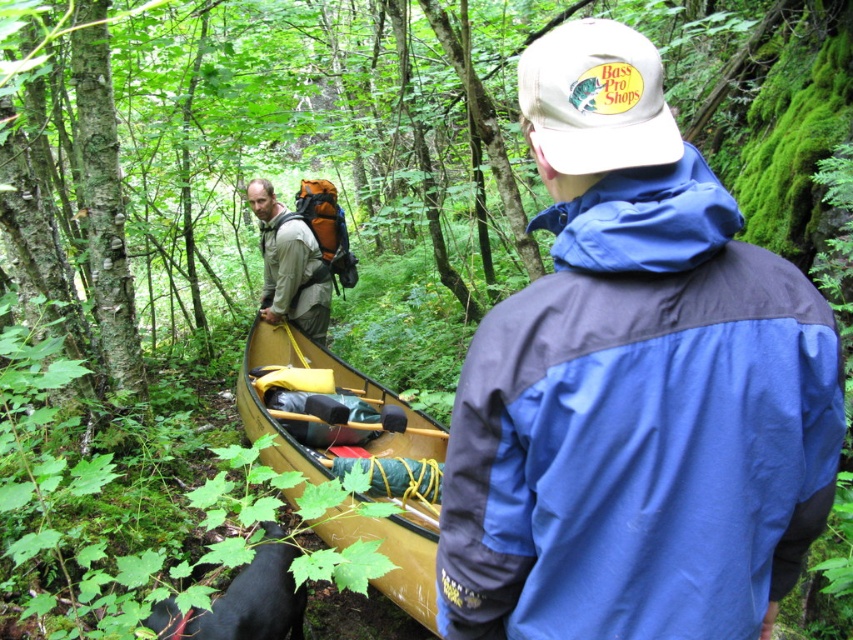
Question: Can you confirm if wooden canoe at center is thinner than yellow plastic paddle at center?

Choices:
 (A) no
 (B) yes

Answer: (A)

Question: Does wooden canoe at center come behind wooden paddle at center?

Choices:
 (A) no
 (B) yes

Answer: (A)

Question: Which object is positioned closest to the wooden canoe at center?

Choices:
 (A) wooden paddle at center
 (B) blue fabric jacket at center
 (C) matte orange backpack at center

Answer: (A)

Question: Does wooden canoe at center appear over yellow plastic paddle at center?

Choices:
 (A) yes
 (B) no

Answer: (B)

Question: Based on their relative distances, which object is nearer to the matte orange backpack at center?

Choices:
 (A) blue fabric jacket at center
 (B) yellow plastic paddle at center
 (C) wooden paddle at center
 (D) wooden canoe at center

Answer: (B)

Question: Which object is the closest to the wooden paddle at center?

Choices:
 (A) wooden canoe at center
 (B) matte orange backpack at center
 (C) yellow plastic paddle at center

Answer: (A)